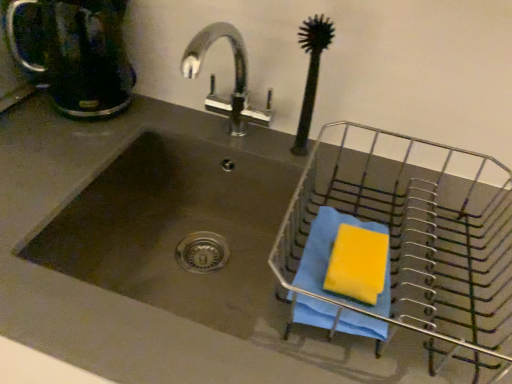
This screenshot has height=384, width=512. Find the location of `vacant space behind blue cloth at right`. vacant space behind blue cloth at right is located at coordinates (368, 200).